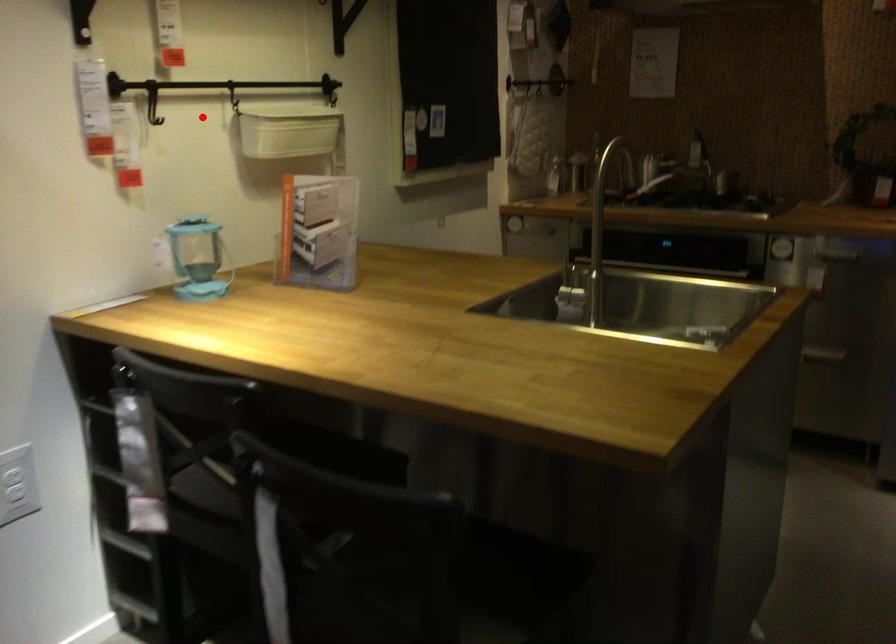
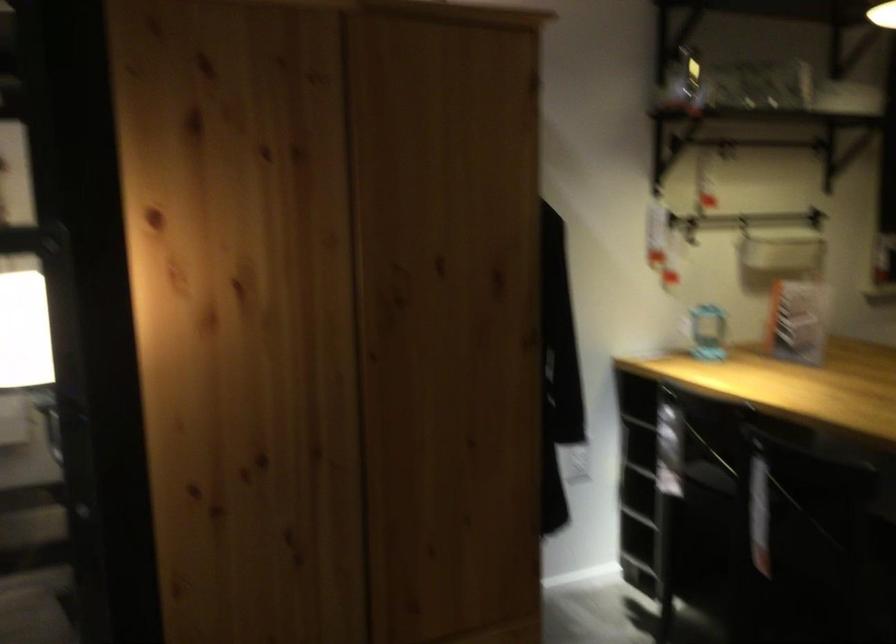
Locate, in the second image, the point that corresponds to the highlighted location in the first image.

(744, 225)